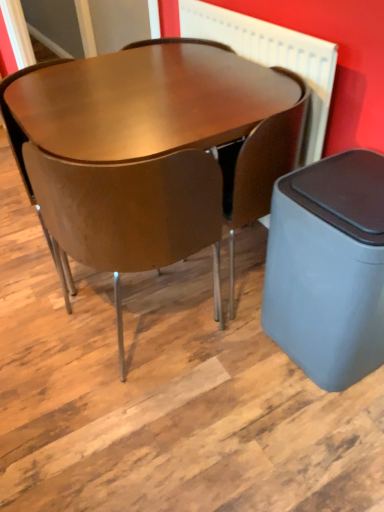
The width and height of the screenshot is (384, 512). I want to click on free space in front of matte brown chair at center, the second chair positioned from the right, so click(x=151, y=418).